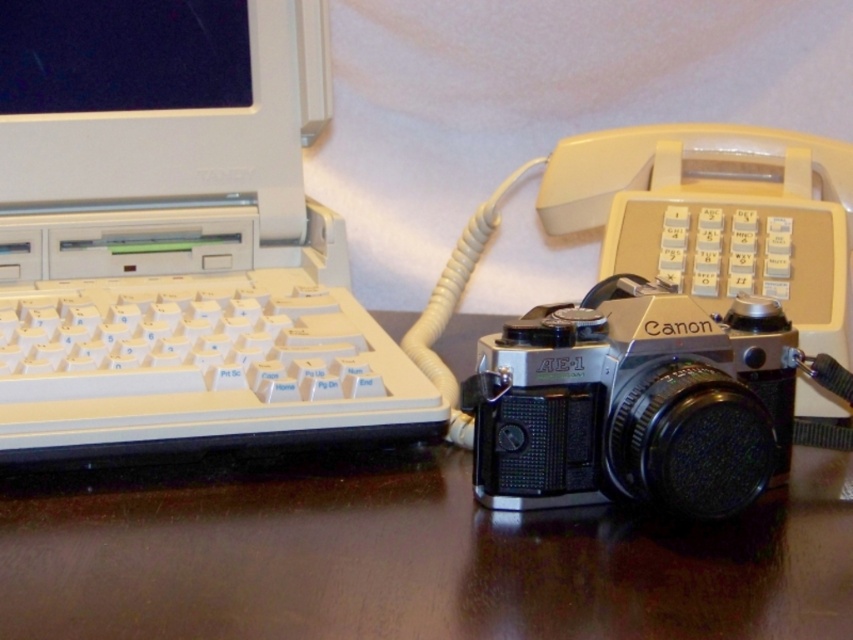
Question: Among these points, which one is farthest from the camera?

Choices:
 (A) (624, 353)
 (B) (16, 298)
 (C) (265, 506)

Answer: (B)

Question: Is white plastic laptop at left wider than silver metallic camera at center?

Choices:
 (A) no
 (B) yes

Answer: (B)

Question: Is the position of white plastic laptop at left more distant than that of white plastic keyboard at left?

Choices:
 (A) yes
 (B) no

Answer: (A)

Question: Which of these objects is positioned closest to the silver metallic camera at center?

Choices:
 (A) dark brown wood table at center
 (B) white plastic laptop at left

Answer: (A)

Question: Does white plastic keyboard at left appear over silver metallic camera at center?

Choices:
 (A) no
 (B) yes

Answer: (B)

Question: Among these objects, which one is farthest from the camera?

Choices:
 (A) white plastic keyboard at left
 (B) dark brown wood table at center
 (C) white plastic laptop at left

Answer: (C)